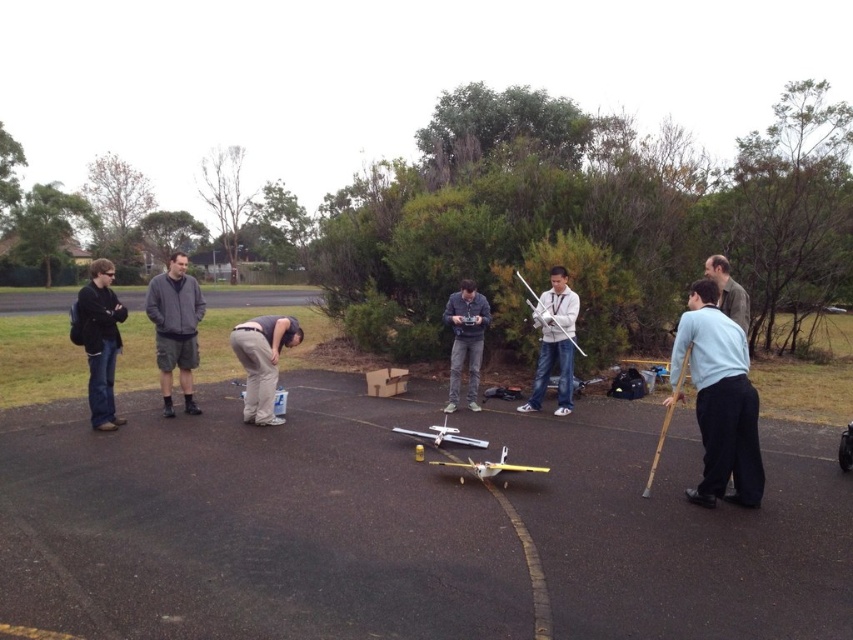
Question: Observing the image, what is the correct spatial positioning of dark blue jeans at left in reference to green fabric shirt at center?

Choices:
 (A) left
 (B) right

Answer: (A)

Question: Which point appears closest to the camera in this image?

Choices:
 (A) (173, 291)
 (B) (247, 326)
 (C) (99, 406)
 (D) (746, 330)

Answer: (D)

Question: Does light blue fabric shirt at right have a greater width compared to green fabric shirt at center?

Choices:
 (A) no
 (B) yes

Answer: (B)

Question: Which of these objects is positioned farthest from the green fabric shirt at center?

Choices:
 (A) dark gray cotton jacket at left
 (B) matte gray shirt at center
 (C) dark blue jeans at left

Answer: (C)

Question: Which of the following is the farthest from the observer?

Choices:
 (A) (166, 356)
 (B) (119, 317)
 (C) (453, 312)

Answer: (C)

Question: Where is tan fabric pants at center located in relation to matte gray shirt at center in the image?

Choices:
 (A) left
 (B) right

Answer: (A)